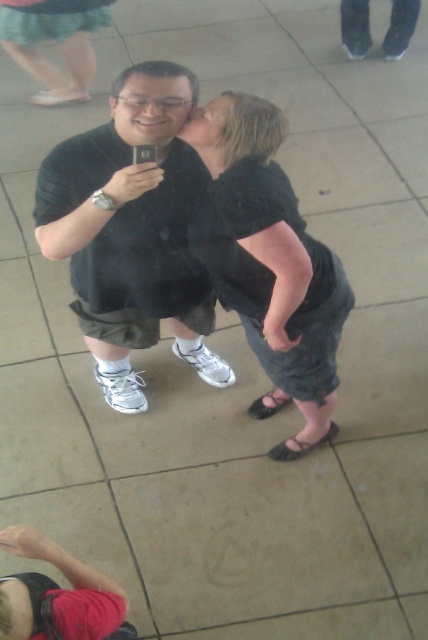
Question: Can you confirm if black cotton shirt at center is positioned above matte black hair at upper center?

Choices:
 (A) yes
 (B) no

Answer: (B)

Question: Which object appears farthest from the camera in this image?

Choices:
 (A) matte black face at center
 (B) black cotton shirt at center

Answer: (A)

Question: Which object is positioned farthest from the black cotton shirt at center?

Choices:
 (A) matte black hair at upper center
 (B) black matte shirt at center

Answer: (A)

Question: Estimate the real-world distances between objects in this image. Which object is farther from the matte black hair at upper center?

Choices:
 (A) black cotton shirt at center
 (B) matte black face at center
 (C) black matte shirt at center

Answer: (C)

Question: Can you confirm if black cotton shirt at center is positioned to the right of matte black hair at upper center?

Choices:
 (A) no
 (B) yes

Answer: (B)

Question: Can you confirm if matte black face at center is positioned to the left of matte black hair at upper center?

Choices:
 (A) yes
 (B) no

Answer: (A)